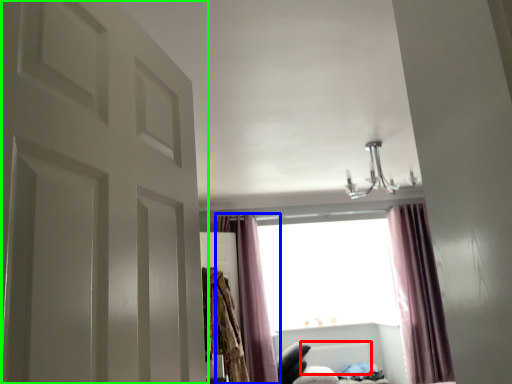
Question: Estimate the real-world distances between objects in this image. Which object is farther from radiator (highlighted by a red box), curtain (highlighted by a blue box) or door (highlighted by a green box)?

Choices:
 (A) curtain
 (B) door

Answer: (B)